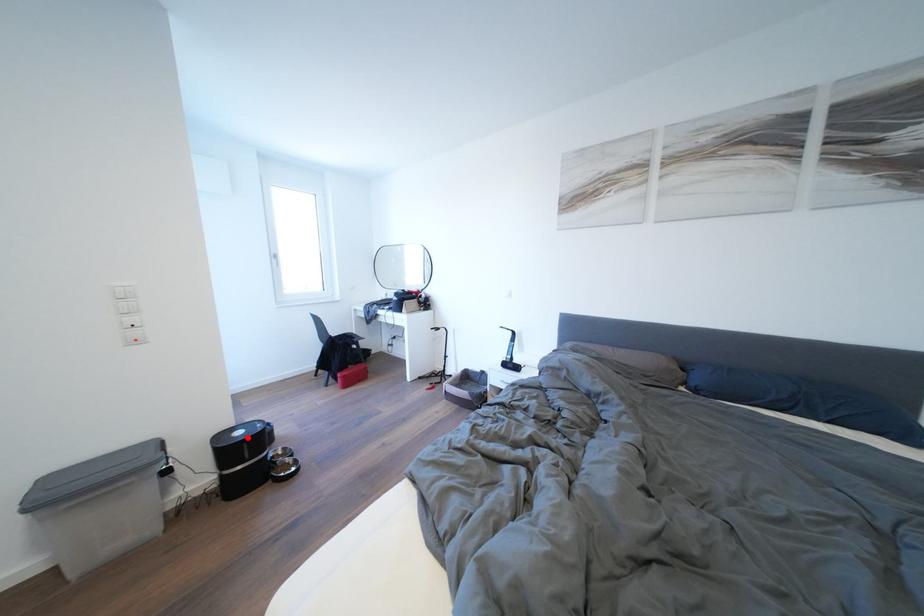
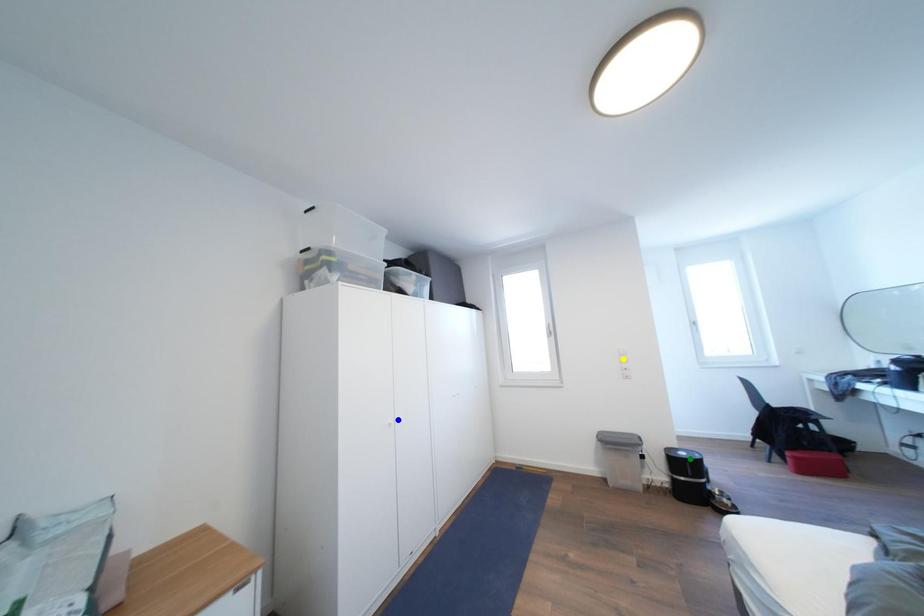
Question: I am providing you with two images of the same scene from different viewpoints. A red point is marked on the first image. You are given multiple points on the second image. Which mark in image 2 goes with the point in image 1?

Choices:
 (A) green point
 (B) blue point
 (C) yellow point

Answer: (A)